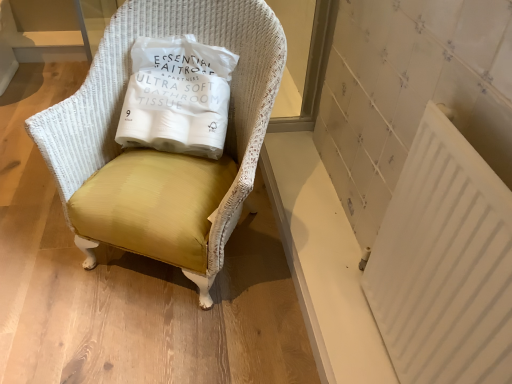
Question: Is white paper bag at center positioned behind matte yellow fabric chair at center?

Choices:
 (A) no
 (B) yes

Answer: (B)

Question: Can you confirm if white paper bag at center is taller than matte yellow fabric chair at center?

Choices:
 (A) yes
 (B) no

Answer: (B)

Question: Is white paper bag at center outside matte yellow fabric chair at center?

Choices:
 (A) no
 (B) yes

Answer: (A)

Question: From the image's perspective, would you say white paper bag at center is shown under matte yellow fabric chair at center?

Choices:
 (A) no
 (B) yes

Answer: (A)

Question: Is white paper bag at center positioned with its back to matte yellow fabric chair at center?

Choices:
 (A) no
 (B) yes

Answer: (B)

Question: Does white paper bag at center touch matte yellow fabric chair at center?

Choices:
 (A) yes
 (B) no

Answer: (B)

Question: Is white plastic radiator at lower right completely or partially outside of white paper bag at center?

Choices:
 (A) no
 (B) yes

Answer: (B)

Question: Could you tell me if white plastic radiator at lower right is turned towards white paper bag at center?

Choices:
 (A) no
 (B) yes

Answer: (A)

Question: Is white plastic radiator at lower right bigger than white paper bag at center?

Choices:
 (A) yes
 (B) no

Answer: (B)

Question: Can you see white plastic radiator at lower right touching white paper bag at center?

Choices:
 (A) yes
 (B) no

Answer: (B)

Question: Does white plastic radiator at lower right have a smaller size compared to white paper bag at center?

Choices:
 (A) no
 (B) yes

Answer: (B)

Question: Is white plastic radiator at lower right shorter than white paper bag at center?

Choices:
 (A) no
 (B) yes

Answer: (A)

Question: Would you say white plastic radiator at lower right is outside matte yellow fabric chair at center?

Choices:
 (A) no
 (B) yes

Answer: (B)